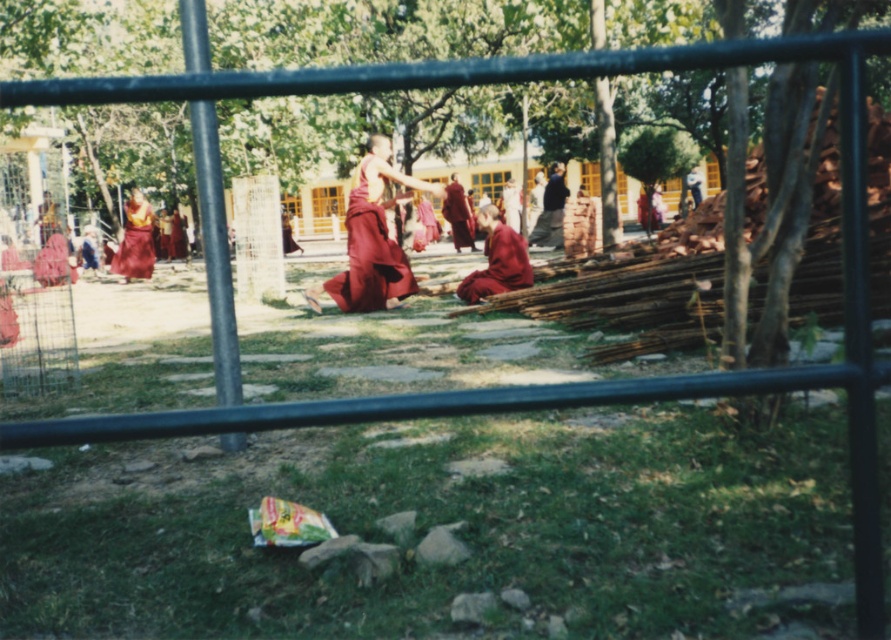
You are a visitor at the monastery and want to throw a small pebble to the dark gray fabric at center without disturbing the matte red robe at left. Given that the pebble can travel 12 meters, is it possible?

The distance between the matte red robe at left and the dark gray fabric at center is 10.86 meters, so the pebble can travel 12 meters. Therefore, it is possible to throw the pebble to the dark gray fabric at center without disturbing the matte red robe at left.